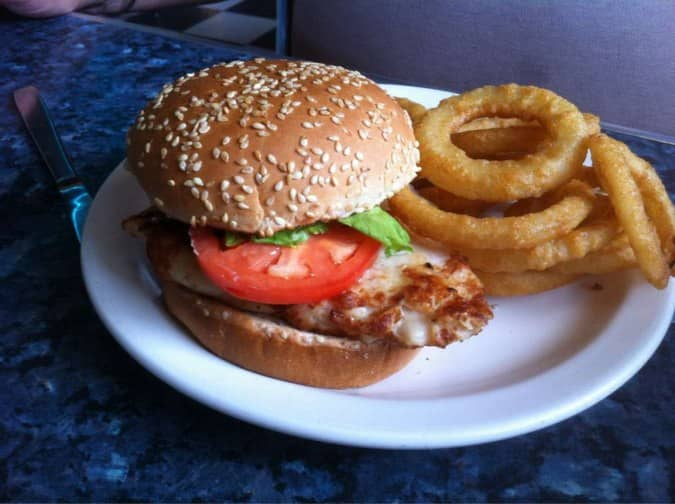
At what (x,y) coordinates should I click in order to perform the action: click on dark blue countertop. Please return your answer as a coordinate pair (x, y). The width and height of the screenshot is (675, 504). Looking at the image, I should click on (180, 446).